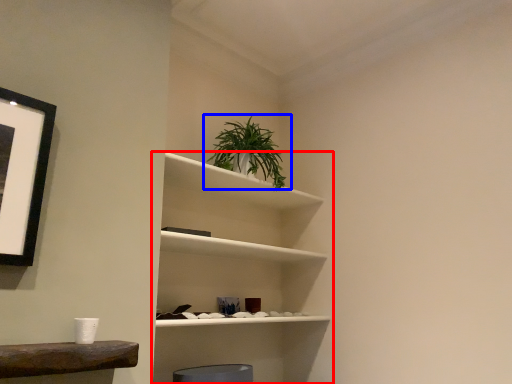
Question: Which object appears closest to the camera in this image, shelf (highlighted by a red box) or houseplant (highlighted by a blue box)?

Choices:
 (A) shelf
 (B) houseplant

Answer: (A)